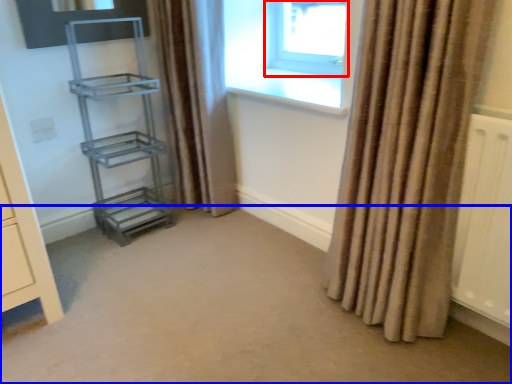
Question: Which object appears closest to the camera in this image, window (highlighted by a red box) or plain (highlighted by a blue box)?

Choices:
 (A) window
 (B) plain

Answer: (B)